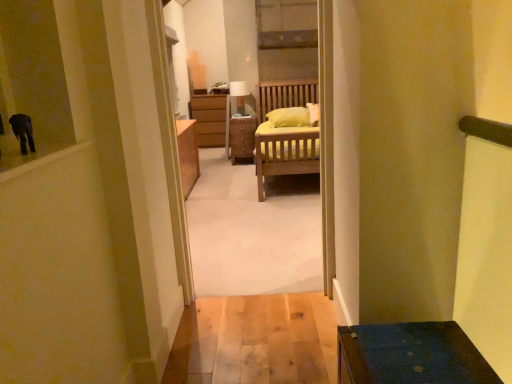
Question: Does matte white lamp at center have a lesser height compared to wooden bed at center?

Choices:
 (A) yes
 (B) no

Answer: (A)

Question: From a real-world perspective, is matte white lamp at center on top of wooden bed at center?

Choices:
 (A) no
 (B) yes

Answer: (B)

Question: Could you tell me if matte white lamp at center is facing wooden bed at center?

Choices:
 (A) yes
 (B) no

Answer: (A)

Question: Is matte white lamp at center bigger than wooden bed at center?

Choices:
 (A) no
 (B) yes

Answer: (A)

Question: Can you confirm if matte white lamp at center is taller than wooden bed at center?

Choices:
 (A) yes
 (B) no

Answer: (B)

Question: From a real-world perspective, is wooden nightstand at center physically located above or below wooden bed at center?

Choices:
 (A) below
 (B) above

Answer: (A)

Question: Considering the positions of wooden nightstand at center and wooden bed at center in the image, is wooden nightstand at center taller or shorter than wooden bed at center?

Choices:
 (A) tall
 (B) short

Answer: (B)

Question: Is wooden nightstand at center wider or thinner than wooden bed at center?

Choices:
 (A) wide
 (B) thin

Answer: (A)

Question: Visually, is wooden nightstand at center positioned to the left or to the right of wooden bed at center?

Choices:
 (A) left
 (B) right

Answer: (A)

Question: Is wooden bed at center taller or shorter than matte white lamp at center?

Choices:
 (A) tall
 (B) short

Answer: (A)

Question: Is point (172, 18) closer or farther from the camera than point (233, 89)?

Choices:
 (A) farther
 (B) closer

Answer: (B)

Question: Is wooden bed at center inside or outside of matte white lamp at center?

Choices:
 (A) inside
 (B) outside

Answer: (B)

Question: Is wooden bed at center to the left or to the right of matte white lamp at center in the image?

Choices:
 (A) right
 (B) left

Answer: (A)

Question: Looking at their shapes, would you say matte white lamp at center is wider or thinner than wooden bed at center?

Choices:
 (A) wide
 (B) thin

Answer: (A)

Question: Is matte white lamp at center in front of or behind wooden bed at center in the image?

Choices:
 (A) behind
 (B) front

Answer: (A)